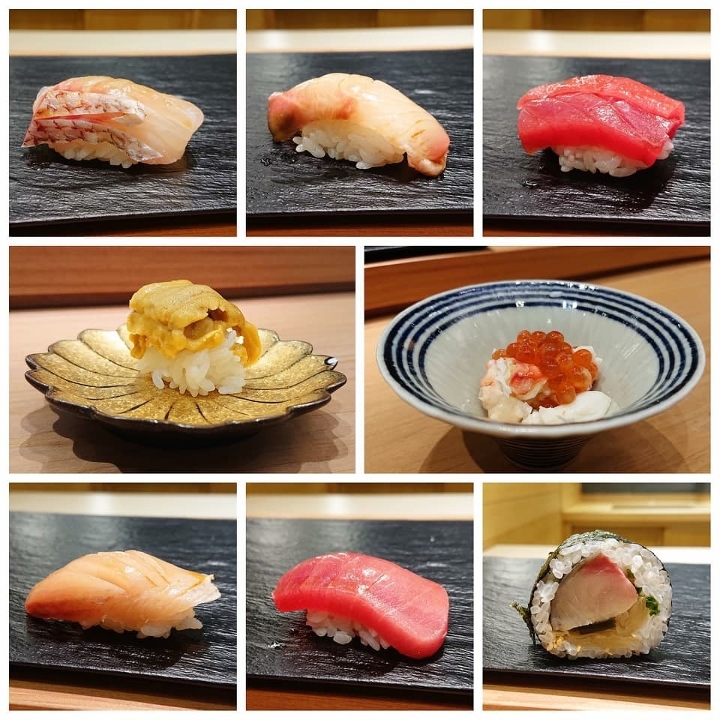
I want to click on black serving table, so click(415, 538), click(682, 638), click(145, 533), click(178, 201), click(432, 73), click(690, 91).